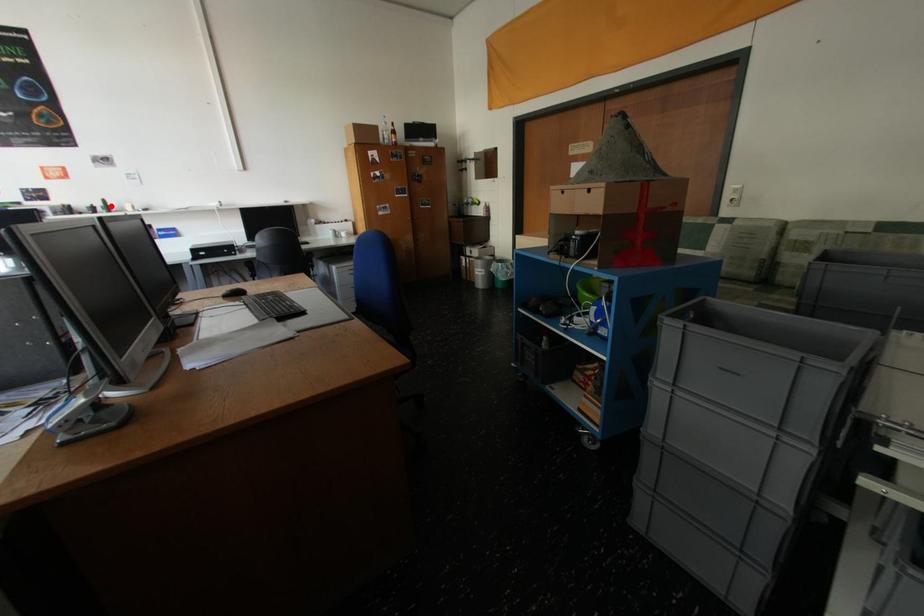
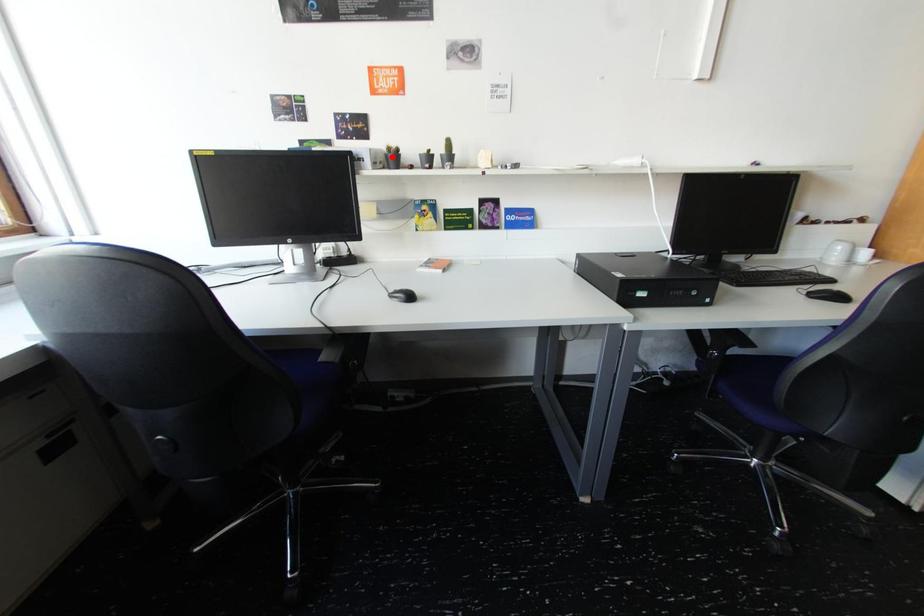
I am providing you with two images of the same scene from different viewpoints. A red point is marked on the first image and another point is marked on the second image. Is the marked point in image1 the same physical position as the marked point in image2?

No